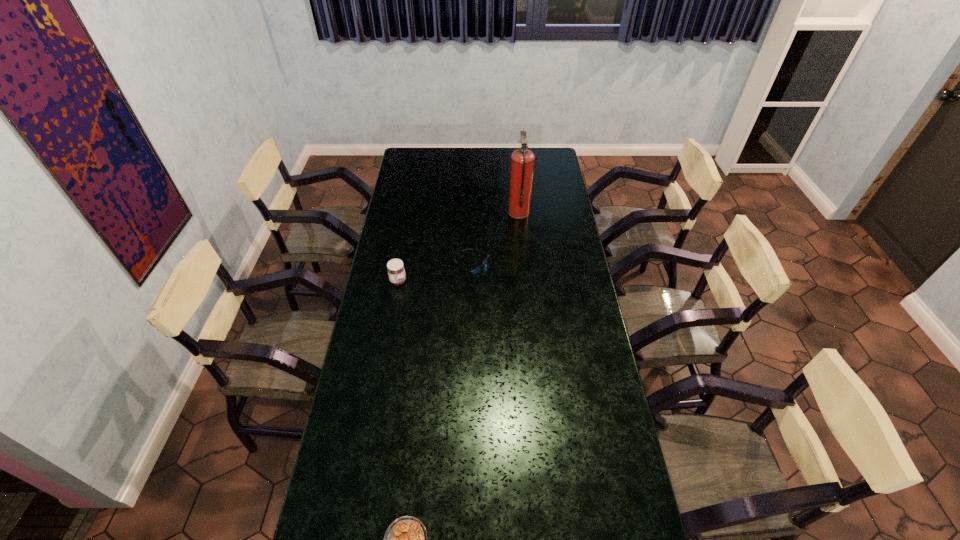
Identify the location of free space located 0.300m at the front of the third object from left to right showing the lenses. (559, 266).

The width and height of the screenshot is (960, 540). I want to click on object that is at the left edge, so click(396, 271).

The image size is (960, 540). Find the location of `vacant space at the left edge`. vacant space at the left edge is located at coordinates (413, 239).

This screenshot has width=960, height=540. I want to click on free space at the right edge, so click(605, 444).

I want to click on vacant area that lies between the farthest object and the sunglasses, so click(494, 239).

Image resolution: width=960 pixels, height=540 pixels. Find the location of `empty location between the farthest object and the third shortest object`. empty location between the farthest object and the third shortest object is located at coordinates (459, 247).

The height and width of the screenshot is (540, 960). I want to click on vacant space that is in between the third object from left to right and the fire extinguisher, so click(494, 239).

The width and height of the screenshot is (960, 540). In order to click on vacant space in between the farthest object and the third tallest object in this screenshot , I will do `click(494, 239)`.

Find the location of a particular element. free space between the sunglasses and the fire extinguisher is located at coordinates (494, 239).

Where is `free space between the leftmost object and the tallest object`? This screenshot has height=540, width=960. free space between the leftmost object and the tallest object is located at coordinates (459, 247).